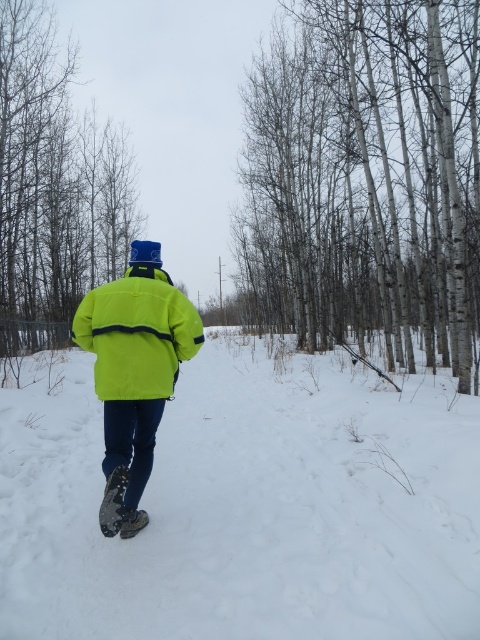
How far apart are smooth gray tree trunk at center and neon yellow jacket at center?

smooth gray tree trunk at center is 31.03 feet from neon yellow jacket at center.

This screenshot has height=640, width=480. I want to click on smooth gray tree trunk at center, so click(x=54, y=188).

At what (x,y) coordinates should I click in order to perform the action: click on smooth gray tree trunk at center. Please return your answer as a coordinate pair (x, y). This screenshot has width=480, height=640. Looking at the image, I should click on (54, 188).

Who is more distant from viewer, (247, 195) or (1, 0)?

The point (247, 195) is behind.

Can you confirm if smooth white tree at center is positioned to the left of smooth gray tree trunk at center?

In fact, smooth white tree at center is to the right of smooth gray tree trunk at center.

Where is `smooth white tree at center`? Image resolution: width=480 pixels, height=640 pixels. smooth white tree at center is located at coordinates (365, 177).

Between white fluffy snow at center and bright yellow jacket at center, which one is positioned higher?

Positioned higher is bright yellow jacket at center.

Who is positioned more to the right, white fluffy snow at center or bright yellow jacket at center?

white fluffy snow at center is more to the right.

Which is in front, point (110, 545) or point (197, 330)?

Point (197, 330) is in front.

Where is `white fluffy snow at center`? The height and width of the screenshot is (640, 480). white fluffy snow at center is located at coordinates (245, 506).